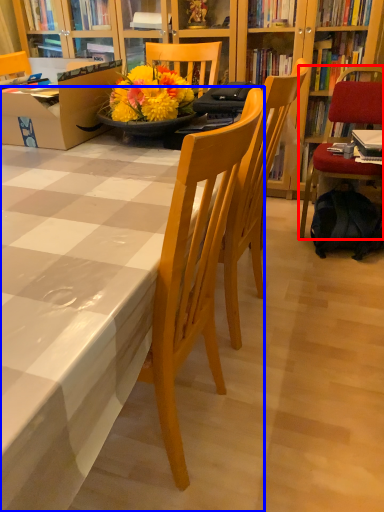
Question: Which point is closer to the camera, chair (highlighted by a red box) or kitchen & dining room table (highlighted by a blue box)?

Choices:
 (A) chair
 (B) kitchen & dining room table

Answer: (B)